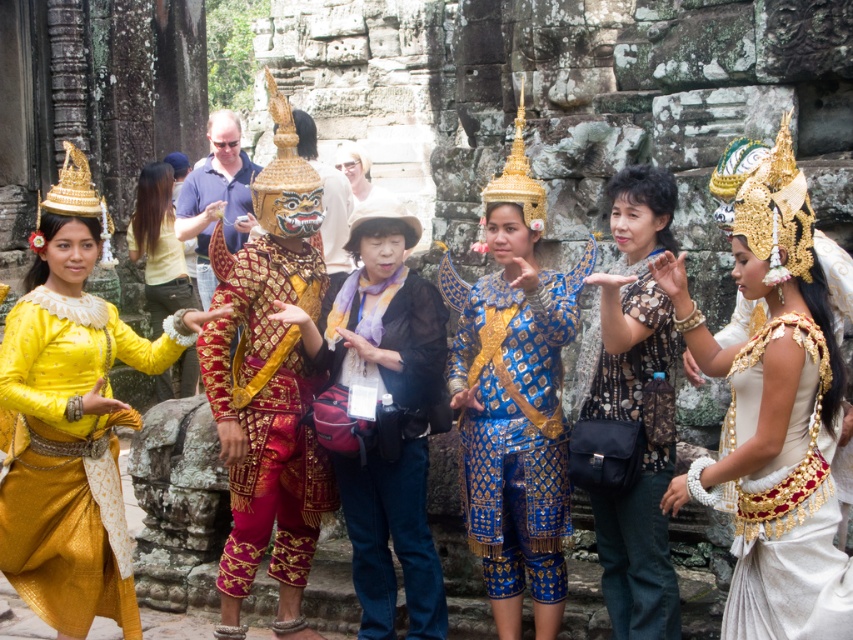
Question: Which point is farther from the camera taking this photo?

Choices:
 (A) (482, 412)
 (B) (737, 600)
 (C) (352, 156)
 (D) (44, 352)

Answer: (C)

Question: Does blue silk costume at center appear over light beige fabric at center?

Choices:
 (A) no
 (B) yes

Answer: (A)

Question: Is gold brocade mask at center further to camera compared to blue silk costume at center?

Choices:
 (A) no
 (B) yes

Answer: (B)

Question: Which of these objects is positioned closest to the yellow fabric at left?

Choices:
 (A) light beige fabric at center
 (B) purple fabric scarf at center
 (C) matte gold costume at left
 (D) white silk headdress at center

Answer: (A)

Question: Can you confirm if printed cotton shirt at center is smaller than yellow fabric at left?

Choices:
 (A) no
 (B) yes

Answer: (A)

Question: Which point is farther to the camera?

Choices:
 (A) (630, 164)
 (B) (439, 298)
 (C) (814, 340)

Answer: (A)